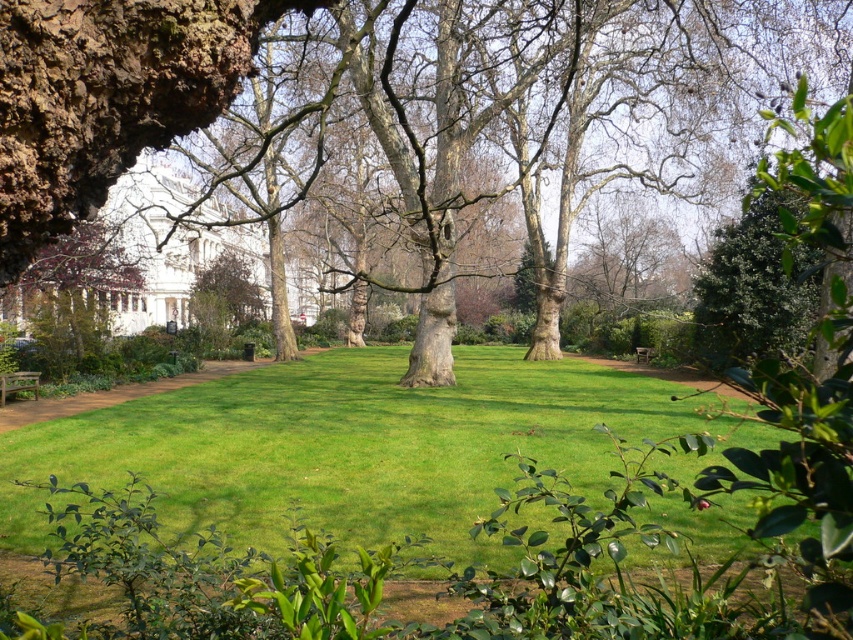
Between brown rough bark tree at center and wooden park bench at lower left, which one has more height?

brown rough bark tree at center is taller.

Find the location of a particular element. This screenshot has width=853, height=640. brown rough bark tree at center is located at coordinates (106, 97).

Locate an element on the screen. Image resolution: width=853 pixels, height=640 pixels. brown rough bark tree at center is located at coordinates (106, 97).

Find the location of a particular element. smooth bark tree at left is located at coordinates (74, 294).

Is point (132, 273) less distant than point (654, 352)?

Yes, it is.

Identify the location of smooth bark tree at left. (74, 294).

Image resolution: width=853 pixels, height=640 pixels. Describe the element at coordinates (106, 97) in the screenshot. I see `brown rough bark tree at center` at that location.

Does brown rough bark tree at center appear on the left side of smooth bark tree at left?

No, brown rough bark tree at center is not to the left of smooth bark tree at left.

Find the location of a particular element. The image size is (853, 640). brown rough bark tree at center is located at coordinates (106, 97).